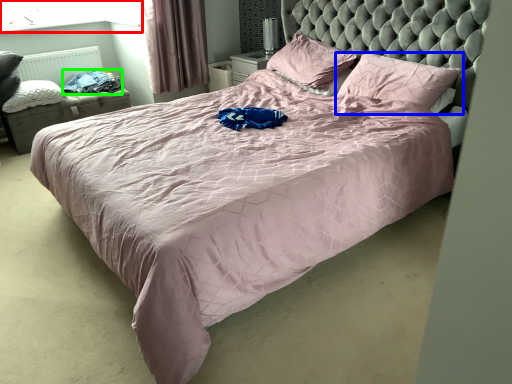
Question: Which object is positioned closest to window screen (highlighted by a red box)? Select from pillow (highlighted by a blue box) and clothing (highlighted by a green box).

Choices:
 (A) pillow
 (B) clothing

Answer: (B)